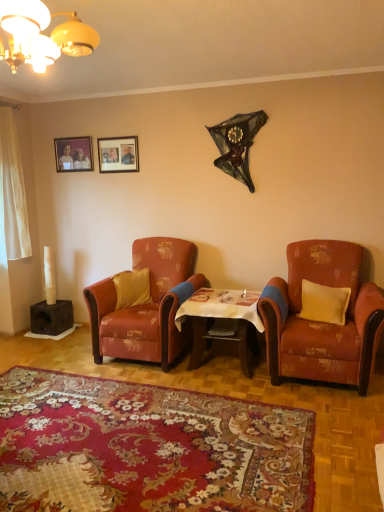
Question: Is wooden table at center located within matte wooden picture frame at upper center, which is the 1th picture frame in right-to-left order?

Choices:
 (A) yes
 (B) no

Answer: (B)

Question: Is matte wooden picture frame at upper center, acting as the second picture frame starting from the left, behind wooden table at center?

Choices:
 (A) yes
 (B) no

Answer: (A)

Question: Is matte wooden picture frame at upper center, which is the 1th picture frame in right-to-left order, facing towards wooden table at center?

Choices:
 (A) yes
 (B) no

Answer: (B)

Question: Is matte wooden picture frame at upper center, which is the 1th picture frame in right-to-left order, turned away from wooden table at center?

Choices:
 (A) yes
 (B) no

Answer: (B)

Question: Does matte wooden picture frame at upper center, which is the 1th picture frame in right-to-left order, have a greater height compared to wooden table at center?

Choices:
 (A) no
 (B) yes

Answer: (A)

Question: From the image's perspective, relative to matte wooden picture frame at upper center, which is the 1th picture frame in right-to-left order, is wooden table at center above or below?

Choices:
 (A) below
 (B) above

Answer: (A)

Question: Do you think wooden table at center is within matte wooden picture frame at upper center, acting as the second picture frame starting from the left, or outside of it?

Choices:
 (A) outside
 (B) inside

Answer: (A)

Question: In terms of width, does wooden table at center look wider or thinner when compared to matte wooden picture frame at upper center, which is the 1th picture frame in right-to-left order?

Choices:
 (A) wide
 (B) thin

Answer: (A)

Question: From a real-world perspective, relative to matte wooden picture frame at upper center, acting as the second picture frame starting from the left, is wooden table at center vertically above or below?

Choices:
 (A) below
 (B) above

Answer: (A)

Question: From the image's perspective, is floral carpet at center located above or below distressed orange fabric armchair at right, the first chair from the right?

Choices:
 (A) above
 (B) below

Answer: (B)

Question: Visually, is floral carpet at center positioned to the left or to the right of distressed orange fabric armchair at right, the first chair from the right?

Choices:
 (A) right
 (B) left

Answer: (B)

Question: In terms of height, does floral carpet at center look taller or shorter compared to distressed orange fabric armchair at right, the first chair from the right?

Choices:
 (A) short
 (B) tall

Answer: (A)

Question: From a real-world perspective, relative to distressed orange fabric armchair at right, the first chair from the right, is floral carpet at center vertically above or below?

Choices:
 (A) below
 (B) above

Answer: (A)

Question: Is point (119, 146) positioned closer to the camera than point (302, 329)?

Choices:
 (A) closer
 (B) farther

Answer: (B)

Question: From a real-world perspective, is matte wooden picture frame at upper center, acting as the second picture frame starting from the left, positioned above or below distressed orange fabric armchair at right, the first chair from the right?

Choices:
 (A) above
 (B) below

Answer: (A)